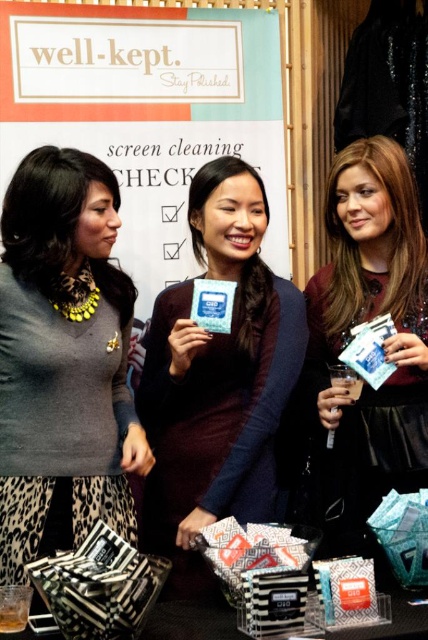
Where is the matte gray sweater at center located in the image?

The matte gray sweater at center is located at point 0.561 in the x coordinate and 0.150 in the y coordinate.

You are organizing a product launch event and need to arrange two promotional cards on a table. The cards are labeled as the matte blue card at center and the matte black card at center. According to the scene provided, which card should be placed to the left when setting them up?

The matte blue card at center should be placed to the left of the matte black card at center since it is positioned on the left side of the matte black card at center in the scene.